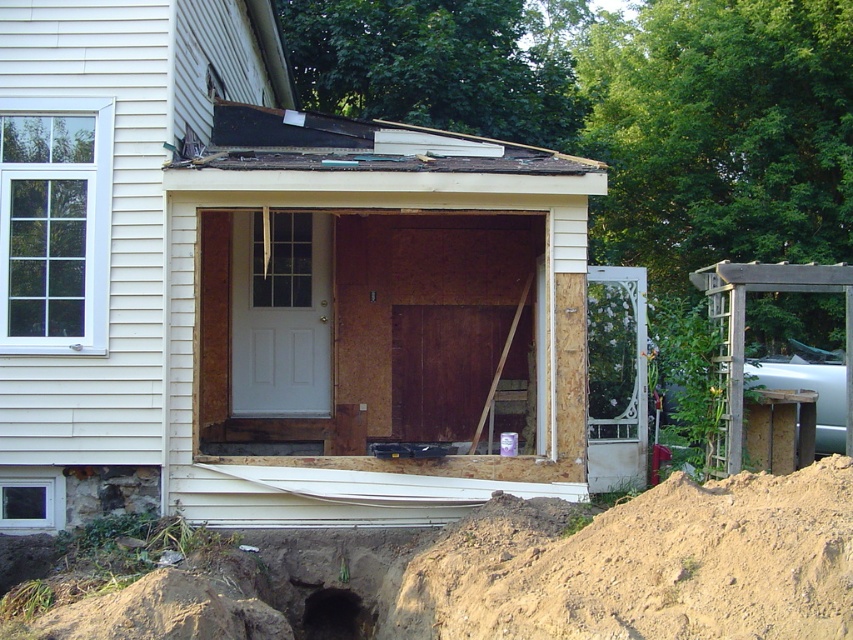
Question: Among these points, which one is farthest from the camera?

Choices:
 (A) (822, 593)
 (B) (347, 588)

Answer: (B)

Question: Is brown dirt mound at lower right positioned behind black dirt hole at lower center?

Choices:
 (A) no
 (B) yes

Answer: (A)

Question: Does brown dirt mound at lower right have a greater width compared to black dirt hole at lower center?

Choices:
 (A) yes
 (B) no

Answer: (A)

Question: Does brown dirt mound at lower right have a lesser width compared to black dirt hole at lower center?

Choices:
 (A) yes
 (B) no

Answer: (B)

Question: Among these objects, which one is farthest from the camera?

Choices:
 (A) brown dirt mound at lower right
 (B) black dirt hole at lower center

Answer: (B)